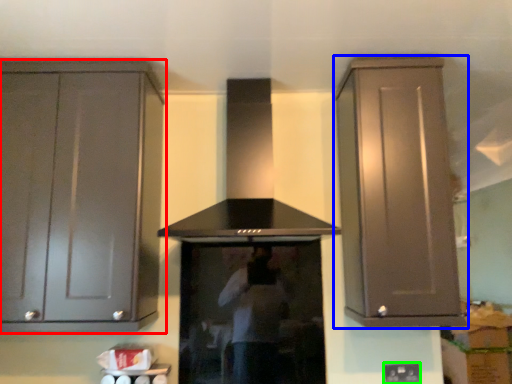
Question: Which object is positioned farthest from cabinetry (highlighted by a red box)? Select from cabinetry (highlighted by a blue box) and electric outlet (highlighted by a green box).

Choices:
 (A) cabinetry
 (B) electric outlet

Answer: (B)